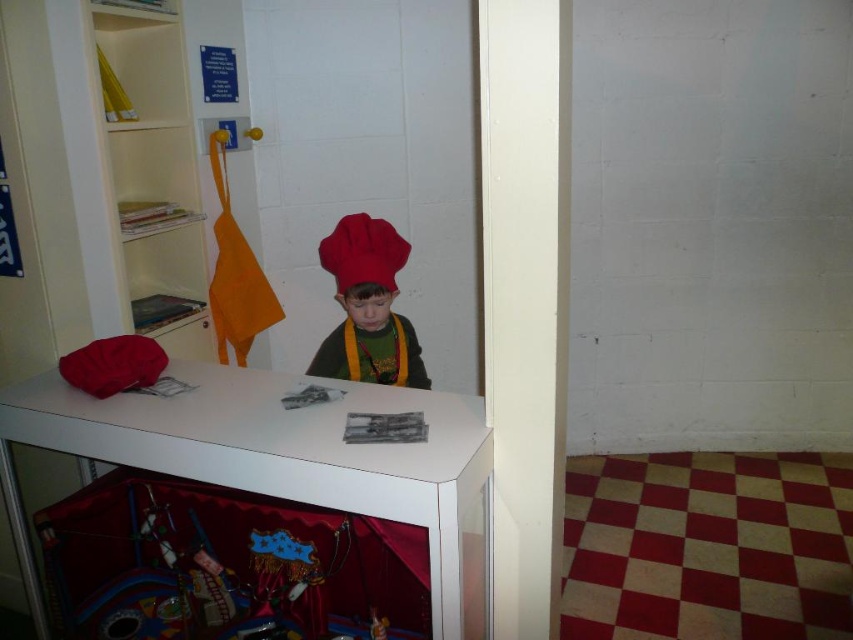
You are a visitor in this room and want to place a new book on the shelf. Where should you go relative to the matte red chef hat at center to reach the white glossy bookshelf at upper left?

You should go to the left of the matte red chef hat at center to reach the white glossy bookshelf at upper left.

You are a delivery person who needs to place a package on the white table in the center of the room. The package must be placed at the exact coordinates of point (132, 166). However, you notice there is a white glossy bookshelf at upper left. Can you place the package there without moving the bookshelf?

The point (132, 166) corresponds to the white glossy bookshelf at upper left, so you cannot place the package there without moving the bookshelf.

In the scene shown: You are a child who wants to reach the top shelf of the white glossy bookshelf at upper left to get a book. You are currently wearing the matte red chef hat at center. Can you reach the top shelf without standing on a stool?

The white glossy bookshelf at upper left is taller than the matte red chef hat at center, so it is likely that the child cannot reach the top shelf without a stool since the bookshelf is taller than the hat, which may indicate the hat is shorter than the shelf height.